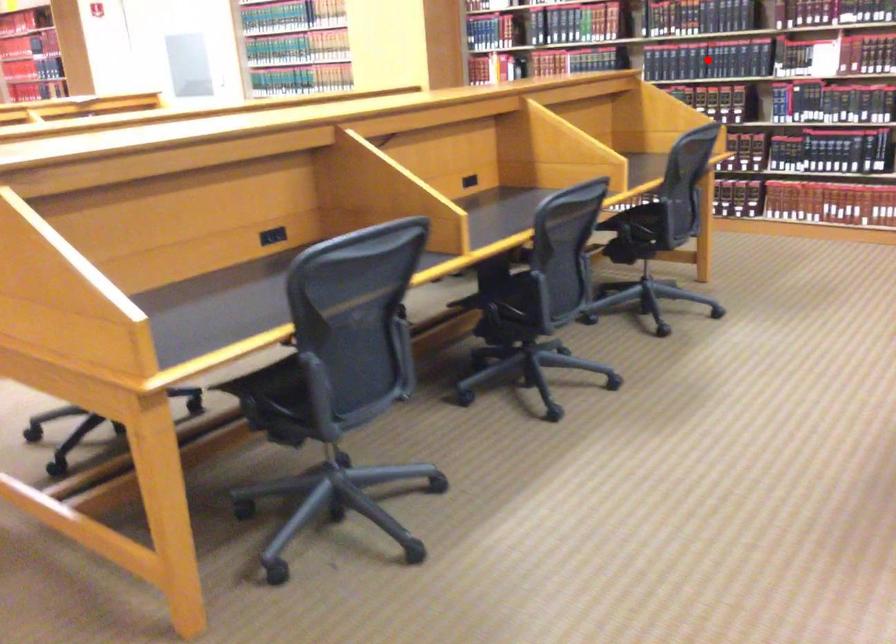
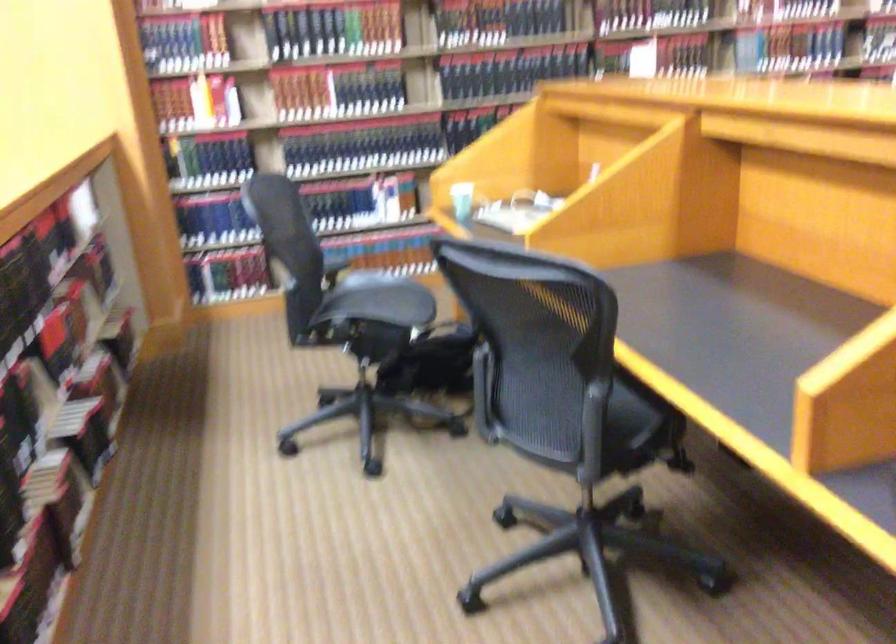
Question: I am providing you with two images of the same scene from different viewpoints. A red point is marked on the first image. Is the red point's position out of view in image 2?

Choices:
 (A) Yes
 (B) No

Answer: (A)